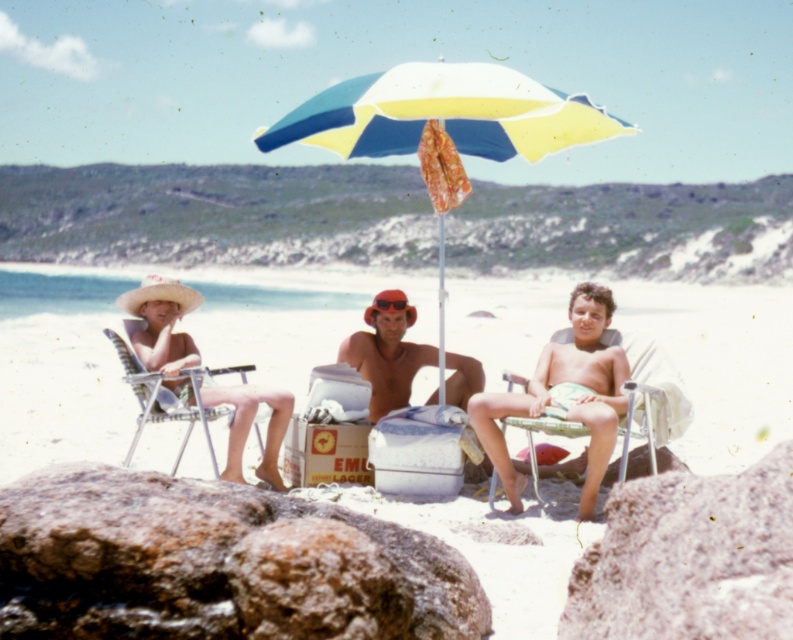
You are a photographer trying to capture a closeup of the rusty rock at lower left without the metallic silver beach chair at left blocking the view. Can you determine if the rock is wider than the chair?

The rusty rock at lower left might be wider than metallic silver beach chair at left, so there is a possibility that the chair could block part of the rock in the photo if they are positioned closely together.

You are a photographer trying to capture a closeup of the rusty rock at lower left without including the granite rock at center in the frame. Based on their positions, is this possible?

The rusty rock at lower left is located below granite rock at center, so positioning the camera low and angling it upwards might allow capturing the rusty rock at lower left without the granite rock at center in the frame.